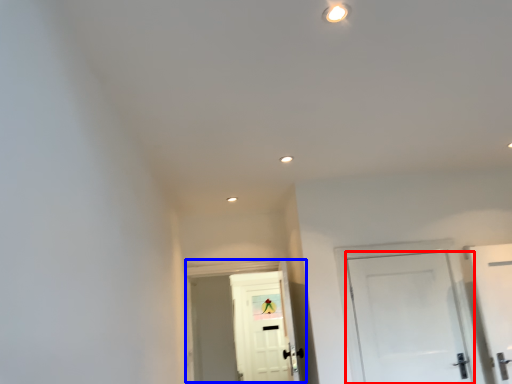
Question: Which point is closer to the camera, door (highlighted by a red box) or door (highlighted by a blue box)?

Choices:
 (A) door
 (B) door

Answer: (A)